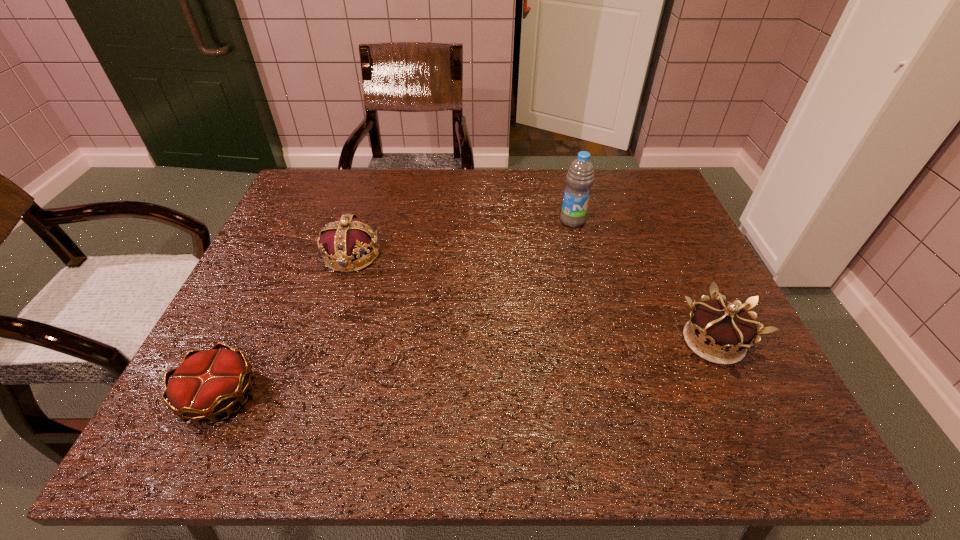
Where is `vacant region between the farthest crown and the farthest object`? Image resolution: width=960 pixels, height=540 pixels. vacant region between the farthest crown and the farthest object is located at coordinates (462, 238).

Locate an element on the screen. This screenshot has height=540, width=960. object identified as the third closest to the third object from left to right is located at coordinates (207, 383).

Locate which object ranks second in proximity to the leftmost object. Please provide its 2D coordinates. Your answer should be formatted as a tuple, i.e. [(x, y)], where the tuple contains the x and y coordinates of a point satisfying the conditions above.

[(580, 177)]

Point out which crown is positioned as the second nearest to the rightmost object. Please provide its 2D coordinates. Your answer should be formatted as a tuple, i.e. [(x, y)], where the tuple contains the x and y coordinates of a point satisfying the conditions above.

[(207, 383)]

Where is `the second closest crown relative to the farthest crown`? the second closest crown relative to the farthest crown is located at coordinates (727, 330).

This screenshot has width=960, height=540. Identify the location of vacant space that satisfies the following two spatial constraints: 1. on the front side of the second farthest object; 2. on the left side of the rightmost object. coord(324,341).

I want to click on vacant space that satisfies the following two spatial constraints: 1. on the front side of the second object from right to left; 2. on the left side of the rightmost object, so click(603, 341).

You are a GUI agent. You are given a task and a screenshot of the screen. Output one action in this format:
    pyautogui.click(x=<x>, y=<y>)
    Task: Click on the vacant space that satisfies the following two spatial constraints: 1. on the back side of the rightmost object; 2. on the right side of the leftmost crown
    Image resolution: width=960 pixels, height=540 pixels.
    Given the screenshot: What is the action you would take?
    pyautogui.click(x=247, y=341)